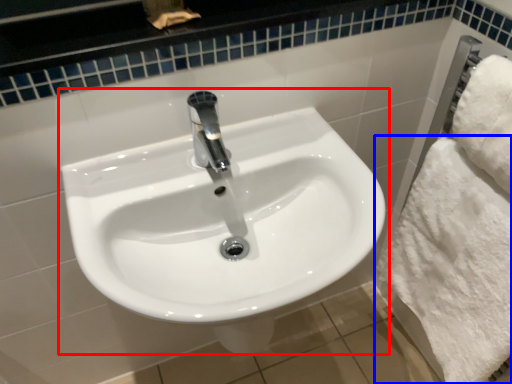
Question: Which object appears farthest to the camera in this image, sink (highlighted by a red box) or bath towel (highlighted by a blue box)?

Choices:
 (A) sink
 (B) bath towel

Answer: (B)